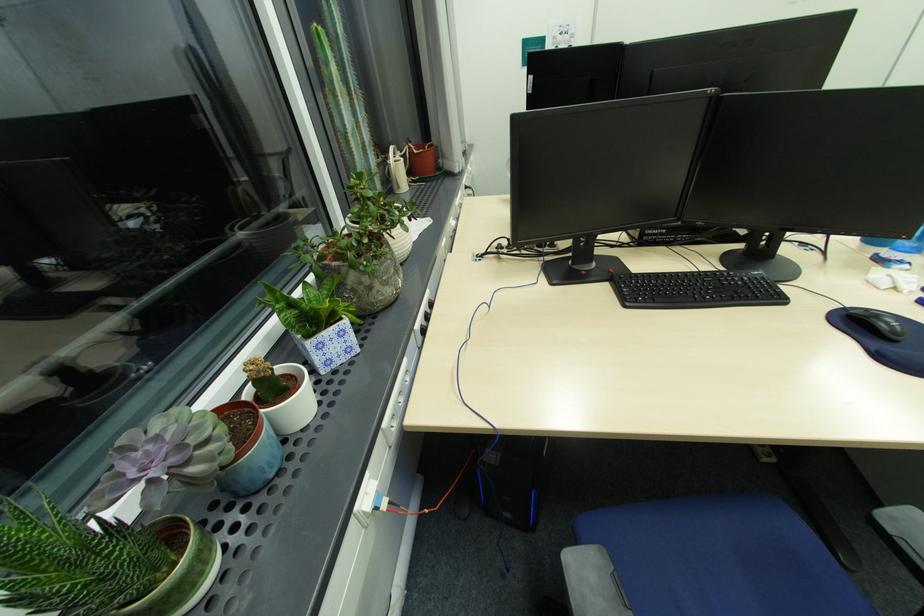
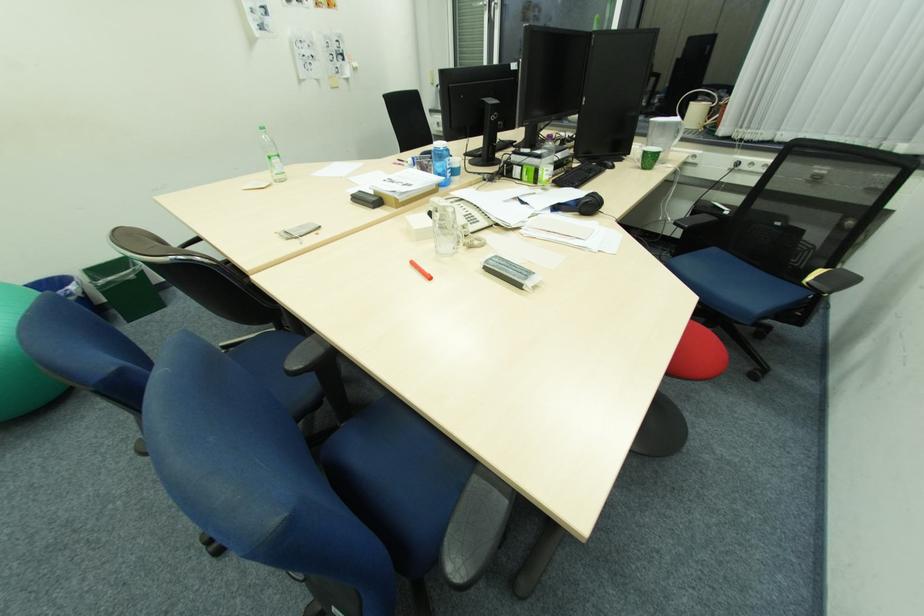
Question: I am providing you with two images of the same scene from different viewpoints. After the viewpoint changes to image2, which objects are now occluded?

Choices:
 (A) green water bottle
 (B) black headphones
 (C) blue ping pong paddle
 (D) white power adapter

Answer: (D)